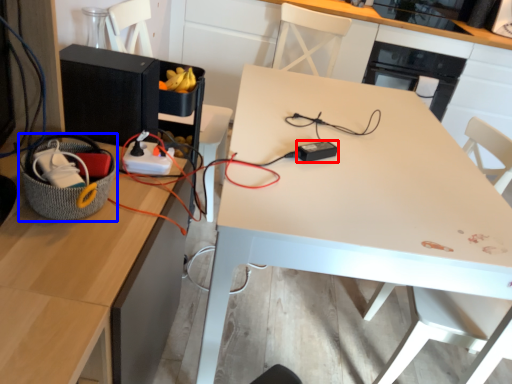
Question: Which of the following is the closest to the observer, appliance (highlighted by a red box) or basket (highlighted by a blue box)?

Choices:
 (A) appliance
 (B) basket

Answer: (B)